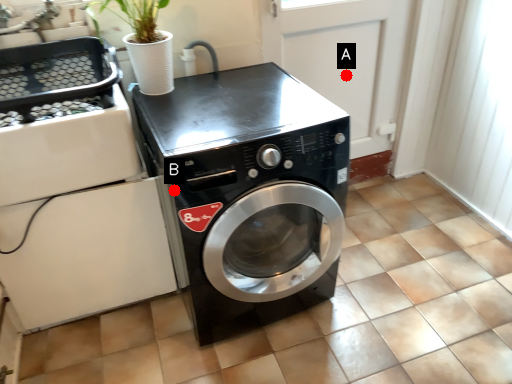
Question: Two points are circled on the image, labeled by A and B beside each circle. Which point is closer to the camera taking this photo?

Choices:
 (A) A is closer
 (B) B is closer

Answer: (B)